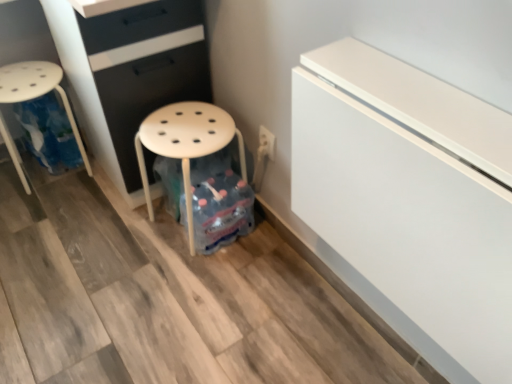
Question: Does matte black chest of drawers at center have a smaller size compared to white plastic stool at left?

Choices:
 (A) no
 (B) yes

Answer: (A)

Question: Would you say matte black chest of drawers at center is a long distance from white plastic stool at left?

Choices:
 (A) yes
 (B) no

Answer: (B)

Question: Considering the relative positions of matte black chest of drawers at center and white plastic stool at left in the image provided, is matte black chest of drawers at center to the right of white plastic stool at left from the viewer's perspective?

Choices:
 (A) no
 (B) yes

Answer: (B)

Question: Does matte black chest of drawers at center have a lesser width compared to white plastic stool at left?

Choices:
 (A) yes
 (B) no

Answer: (B)

Question: Is matte black chest of drawers at center surrounding white plastic stool at left?

Choices:
 (A) no
 (B) yes

Answer: (A)

Question: From the image's perspective, is matte black chest of drawers at center located above white plastic stool at left?

Choices:
 (A) yes
 (B) no

Answer: (A)

Question: Does white glossy fridge at upper right have a larger size compared to white plastic stool at left?

Choices:
 (A) yes
 (B) no

Answer: (A)

Question: Is white glossy fridge at upper right oriented away from white plastic stool at left?

Choices:
 (A) no
 (B) yes

Answer: (A)

Question: Is white glossy fridge at upper right not close to white plastic stool at left?

Choices:
 (A) yes
 (B) no

Answer: (A)

Question: From the image's perspective, does white glossy fridge at upper right appear higher than white plastic stool at left?

Choices:
 (A) no
 (B) yes

Answer: (A)

Question: Can you confirm if white glossy fridge at upper right is wider than white plastic stool at left?

Choices:
 (A) yes
 (B) no

Answer: (B)

Question: Does white glossy fridge at upper right contain white plastic stool at left?

Choices:
 (A) yes
 (B) no

Answer: (B)

Question: From a real-world perspective, is white matte stool at center located beneath white glossy fridge at upper right?

Choices:
 (A) yes
 (B) no

Answer: (A)